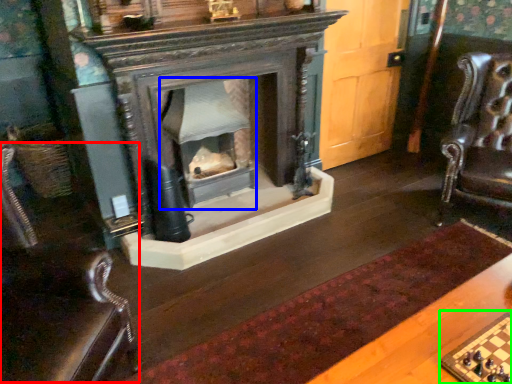
Question: Based on their relative distances, which object is farther from rocking chair (highlighted by a red box)? Choose from fireplace (highlighted by a blue box) and board game (highlighted by a green box).

Choices:
 (A) fireplace
 (B) board game

Answer: (A)